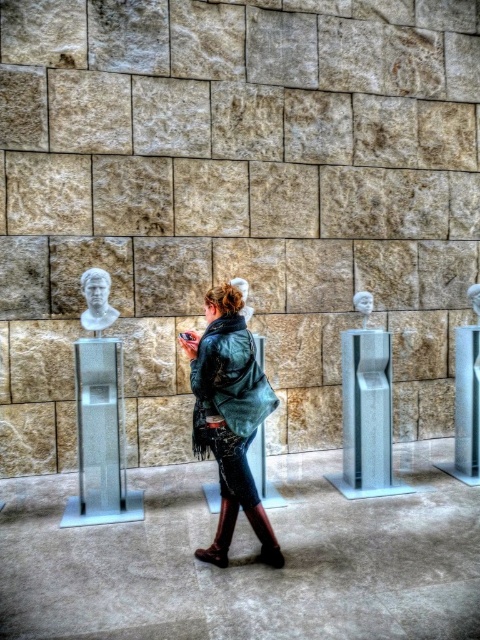
You are standing in the outdoor area and see the green leather jacket at center and the brown leather boot at lower center. Which object is positioned more to the right side?

The brown leather boot at lower center is positioned more to the right side because the green leather jacket at center is to the left of it.